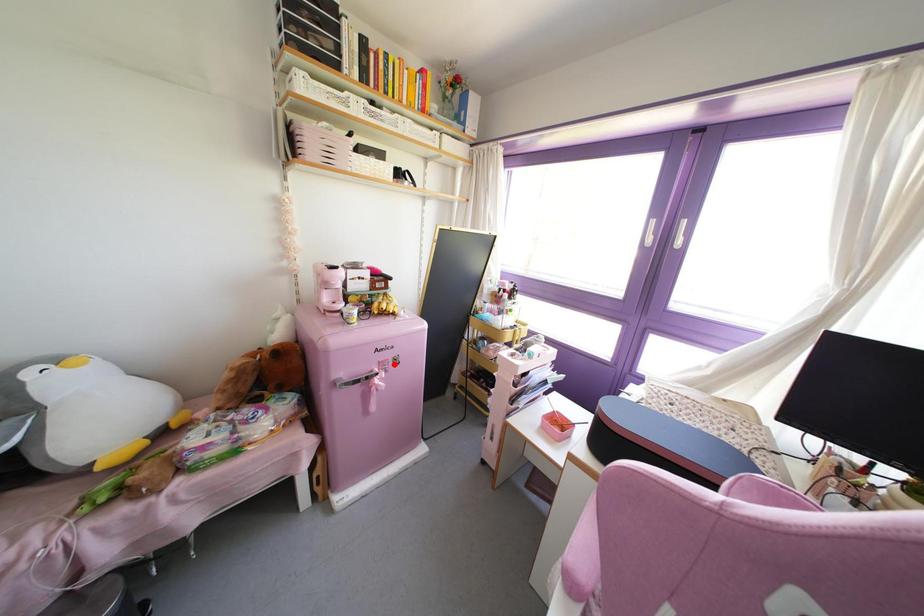
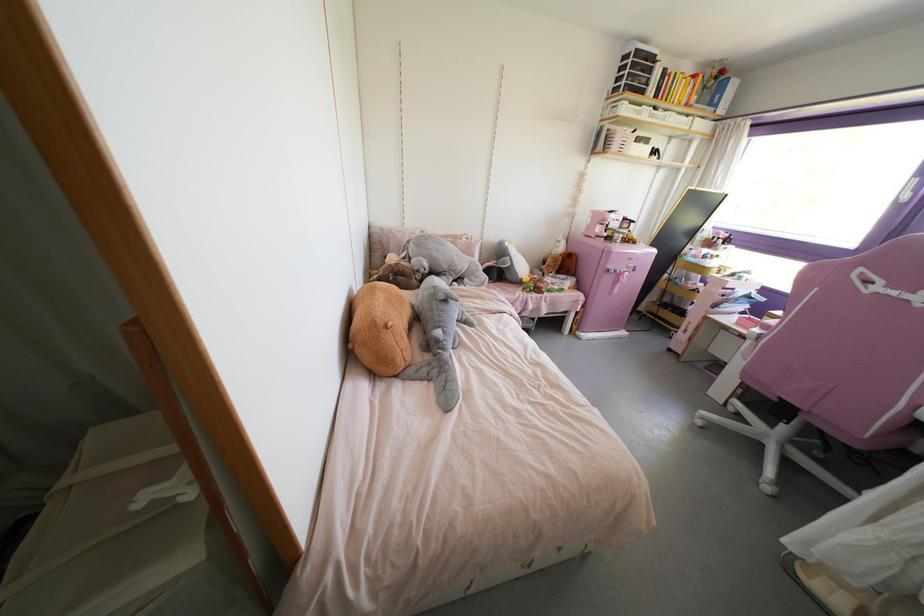
Where in the second image is the point corresponding to the highlighted location from the first image?

(633, 270)